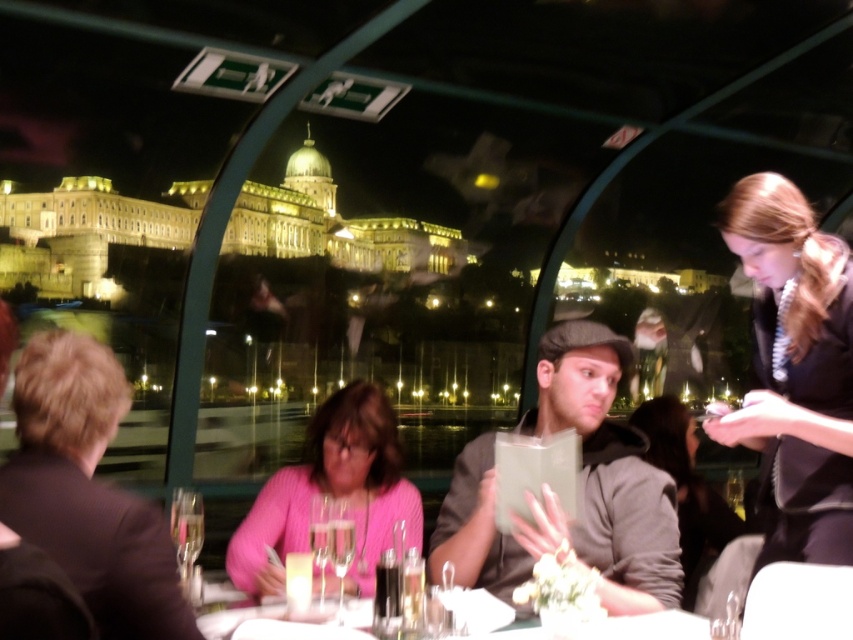
You are a photographer standing at the camera position. You want to take a photo of the brown hair at left. Can you capture it in your photo if your camera has a maximum focus range of 70 meters?

The brown hair at left is 74.20 meters from camera, which exceeds the camera maximum focus range of 70 meters. Therefore, you cannot capture it in your photo.

Consider the image. You are a photographer taking a picture of the matte gray cap at center and the pink knitted sweater at center. Which object should you focus on first to ensure both are in sharp focus?

The matte gray cap at center is closer to the viewer than the pink knitted sweater at center, so you should focus on the matte gray cap at center first to ensure both are in sharp focus.